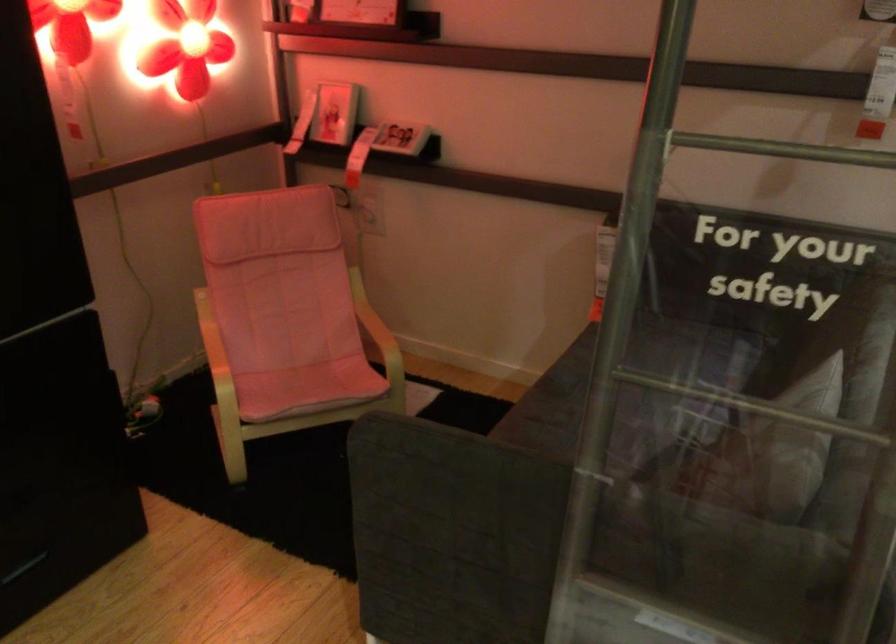
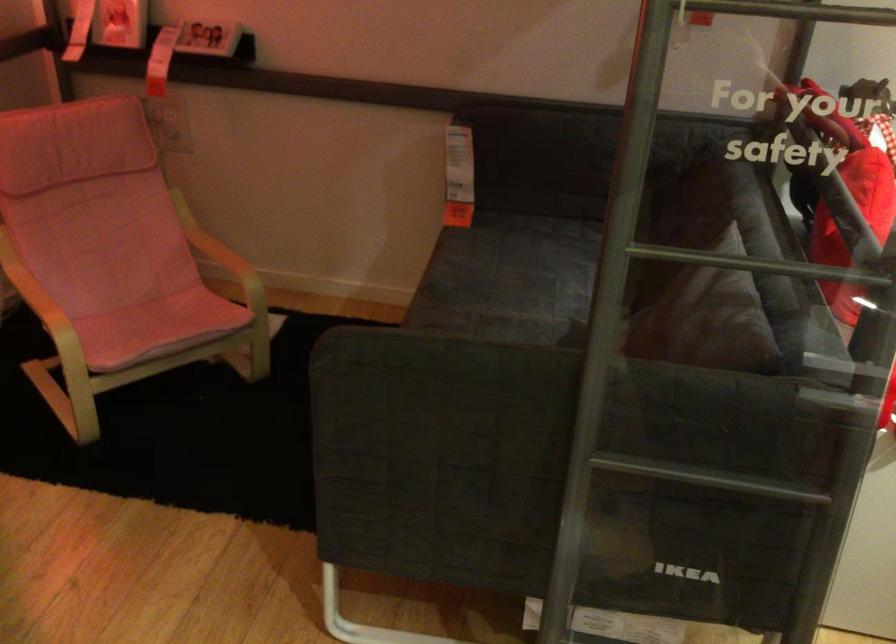
In the second image, find the point that corresponds to pixel 746 404 in the first image.

(760, 263)